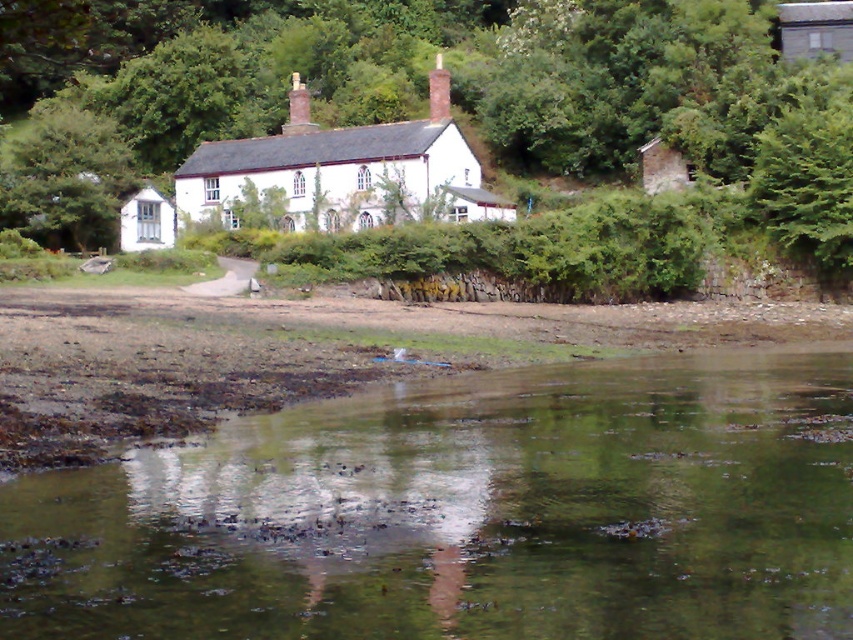
Does green leafy tree at upper center have a larger size compared to white matte cottage at center?

Correct, green leafy tree at upper center is larger in size than white matte cottage at center.

Which is behind, point (837, 266) or point (296, 164)?

Point (296, 164)

This screenshot has height=640, width=853. In order to click on green leafy tree at upper center in this screenshot , I will do `click(422, 72)`.

Is white matte cottage at center closer to the viewer compared to green leafy tree at upper left?

Yes, it is.

Between point (299, 118) and point (119, 172), which one is positioned behind?

The point (299, 118) is behind.

Find the location of a particular element. The image size is (853, 640). white matte cottage at center is located at coordinates (344, 170).

Is the position of green reflective water at lower center more distant than that of white matte cottage at center?

No, it is in front of white matte cottage at center.

Which is more to the right, green reflective water at lower center or white matte cottage at center?

Positioned to the right is green reflective water at lower center.

The image size is (853, 640). Describe the element at coordinates (467, 513) in the screenshot. I see `green reflective water at lower center` at that location.

Where is `green reflective water at lower center`? green reflective water at lower center is located at coordinates (467, 513).